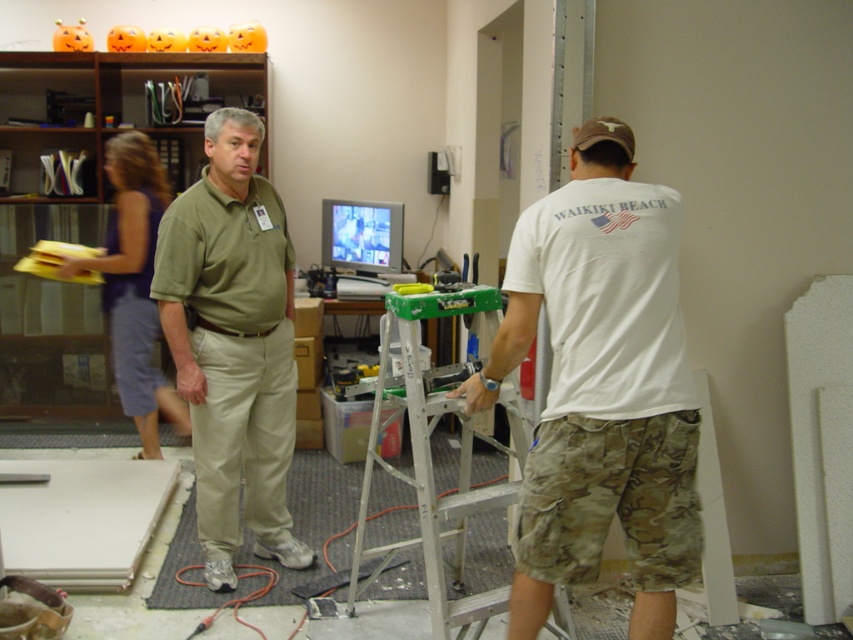
Question: From the image, what is the correct spatial relationship of white cotton t-shirt at center in relation to silver metallic ladder at center?

Choices:
 (A) left
 (B) right

Answer: (B)

Question: Does white cotton t-shirt at center appear on the right side of blue denim shorts at left?

Choices:
 (A) yes
 (B) no

Answer: (A)

Question: Among these objects, which one is farthest from the camera?

Choices:
 (A) white cotton t-shirt at center
 (B) blue denim shorts at left
 (C) khakimaterial/texture at center
 (D) silver metallic ladder at center

Answer: (B)

Question: Which point appears closest to the camera in this image?

Choices:
 (A) (196, 392)
 (B) (183, 420)
 (C) (648, 486)
 (D) (351, 602)

Answer: (C)

Question: Which object appears closest to the camera in this image?

Choices:
 (A) silver metallic ladder at center
 (B) white cotton t-shirt at center

Answer: (B)

Question: Is khakimaterial/texture at center positioned at the back of blue denim shorts at left?

Choices:
 (A) yes
 (B) no

Answer: (B)